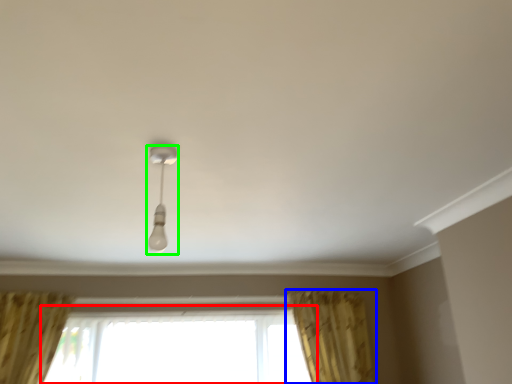
Question: Which object is the farthest from window (highlighted by a red box)? Choose among these: curtain (highlighted by a blue box) or lamp (highlighted by a green box).

Choices:
 (A) curtain
 (B) lamp

Answer: (B)